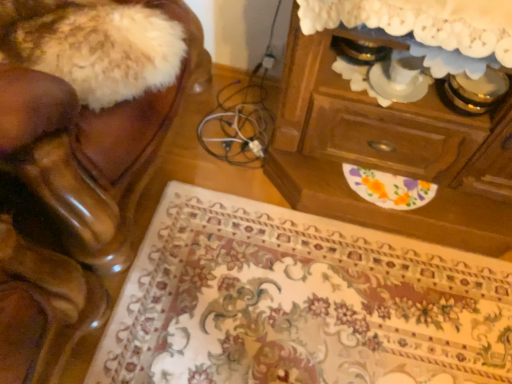
The width and height of the screenshot is (512, 384). Identify the location of free space above floral carpet at lower center (from a real-world perspective). (290, 274).